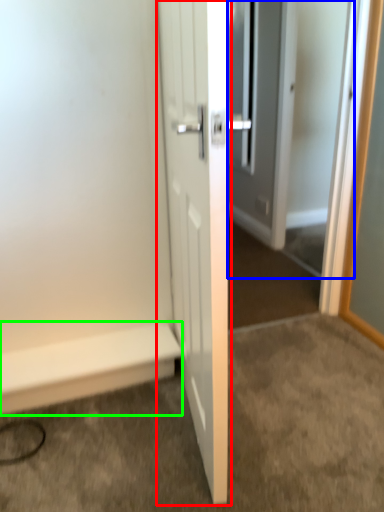
Question: Which object is the farthest from door (highlighted by a red box)? Choose among these: screen door (highlighted by a blue box) or stairwell (highlighted by a green box).

Choices:
 (A) screen door
 (B) stairwell

Answer: (A)